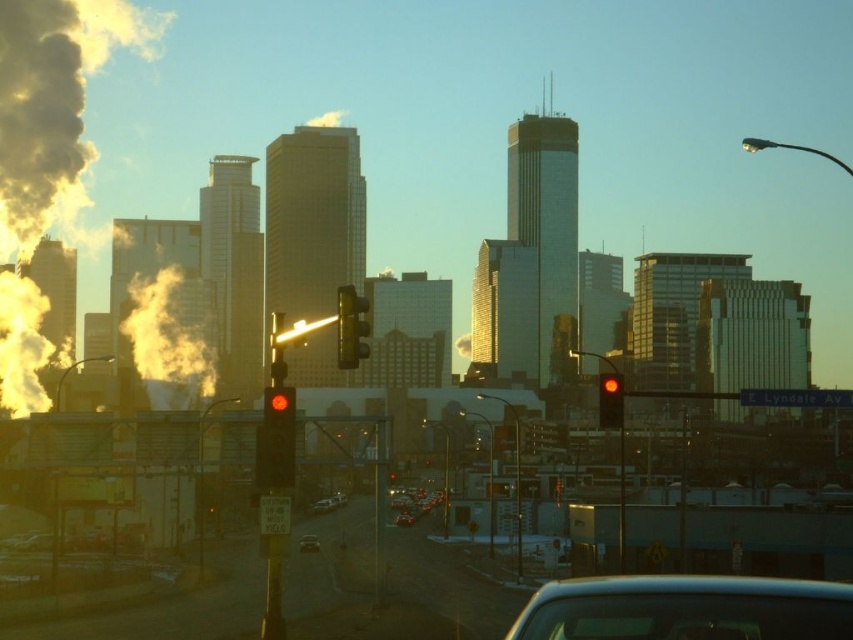
You are a pedestrian standing at the intersection and see the yellowish foggy smoke at left and the shiny silver car at center. Which object is closer to the left side of the image?

The yellowish foggy smoke at left is closer to the left side of the image as it is positioned to the left of the shiny silver car at center.

You are a delivery driver approaching the intersection with the traffic light. You notice yellowish foggy smoke at left. Based on the scene, can you determine if the smoke is closer to you or further away compared to the traffic light?

The yellowish foggy smoke at left is located at point [169,337], which is closer to the viewer than the traffic light, so the smoke is closer to you than the traffic light.

You are a city planner analyzing the urban scene. You notice the point labeled at coordinates (169, 337). Based on the scene description, what does this point likely represent?

The point at coordinates (169, 337) marks yellowish foggy smoke at left, indicating possible environmental conditions or activity in that area.